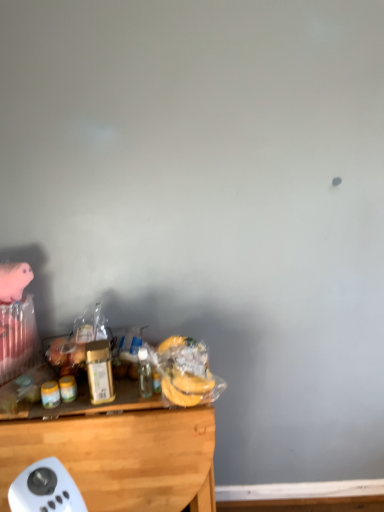
Question: From their relative heights in the image, would you say yellow matte jar at left, the 1th food in the left-to-right sequence, is taller or shorter than metallic gold canister at center, the first bottle positioned from the left?

Choices:
 (A) short
 (B) tall

Answer: (A)

Question: Is point (51, 388) positioned closer to the camera than point (102, 360)?

Choices:
 (A) farther
 (B) closer

Answer: (A)

Question: Which object is the farthest from the metallic gold canister at center, acting as the 2th bottle starting from the right?

Choices:
 (A) translucent plastic bottle at center, marked as the first bottle in a right-to-left arrangement
 (B) translucent plastic bananas at lower center, arranged as the second food when viewed from the left
 (C) wooden desk at lower left
 (D) yellow matte jar at left, the 1th food in the left-to-right sequence

Answer: (B)

Question: Estimate the real-world distances between objects in this image. Which object is farther from the yellow matte jar at left, the 1th food in the left-to-right sequence?

Choices:
 (A) metallic gold canister at center, the first bottle positioned from the left
 (B) translucent plastic bananas at lower center, acting as the first food starting from the right
 (C) translucent plastic bottle at center, marked as the first bottle in a right-to-left arrangement
 (D) wooden desk at lower left

Answer: (B)